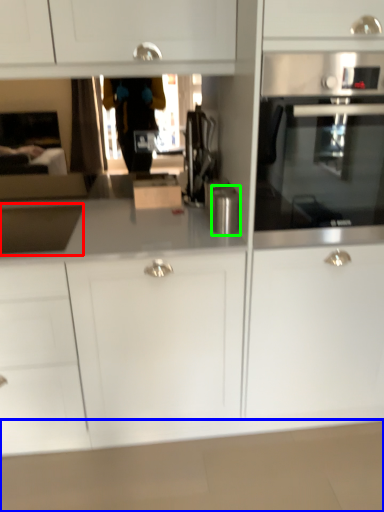
Question: Based on their relative distances, which object is nearer to sink (highlighted by a red box)? Choose from counter top (highlighted by a blue box) and kitchen appliance (highlighted by a green box).

Choices:
 (A) counter top
 (B) kitchen appliance

Answer: (B)